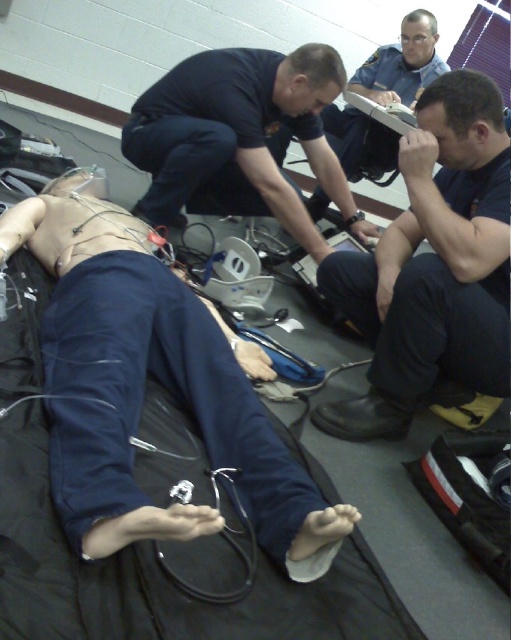
You are a medical student in the training room. You need to place a medical kit on the blue fabric at lower left. To ensure accuracy, what are the exact coordinates where you should place it?

The blue fabric at lower left should be placed at coordinates point [144,387].

You are an emergency responder in the training facility. You notice a blue fabric at lower left and a black matte uniform at center. Which object is closer to you?

The blue fabric at lower left is closer to you because it is in front of the black matte uniform at center.